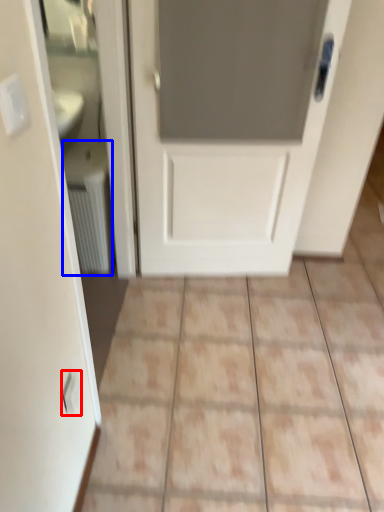
Question: Which object is further to the camera taking this photo, electric outlet (highlighted by a red box) or radiator (highlighted by a blue box)?

Choices:
 (A) electric outlet
 (B) radiator

Answer: (B)